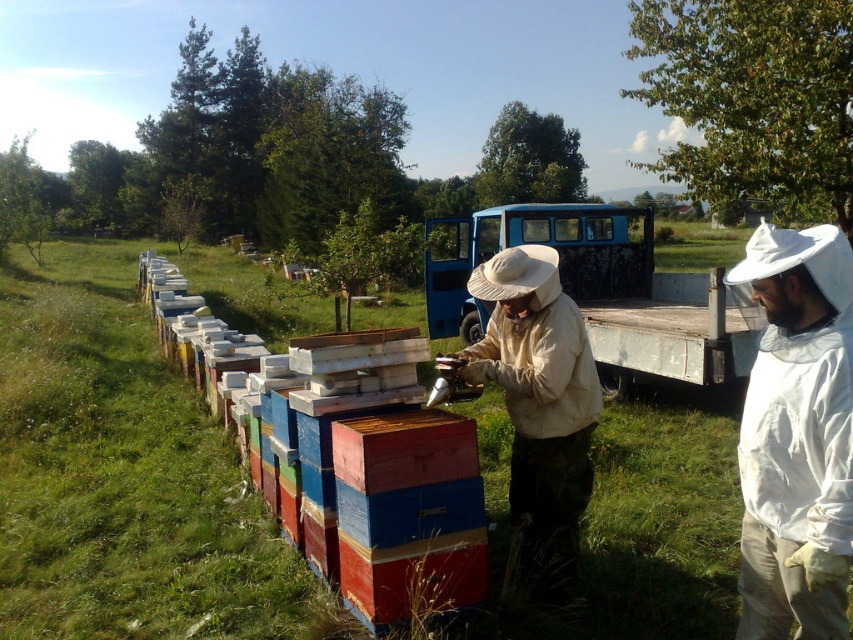
You are a drone operator trying to capture a closeup of the beehives. You have two points marked in the scene, point 1 at coordinates point (167, 326) and point 2 at coordinates point (554, 372). Which point should you focus on to get a closer shot without moving the drone?

Point 1 at coordinates point (167, 326) is closer to the camera, so focusing on it will provide a closer shot without moving the drone.

You are a beekeeper trying to determine the space required to move between the wooden beehive at left and the white cotton beekeeper suit at center. Based on their widths, which one is wider?

The wooden beehive at left is wider than the white cotton beekeeper suit at center because its width surpasses the suit.